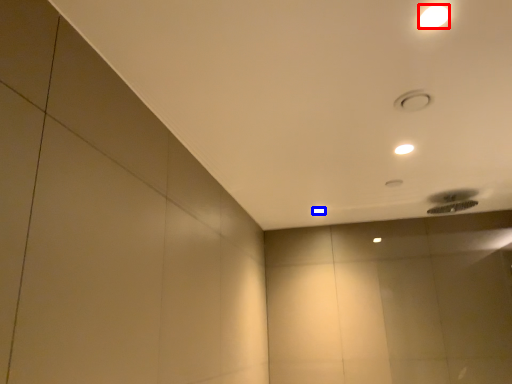
Question: Which point is closer to the camera, lamp (highlighted by a red box) or lamp (highlighted by a blue box)?

Choices:
 (A) lamp
 (B) lamp

Answer: (A)